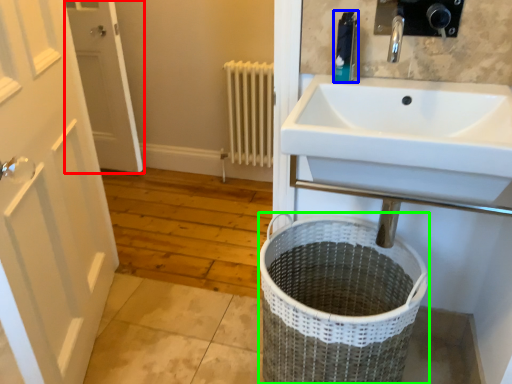
Question: Based on their relative distances, which object is farther from door (highlighted by a red box)? Choose from toiletry (highlighted by a blue box) and laundry basket (highlighted by a green box).

Choices:
 (A) toiletry
 (B) laundry basket

Answer: (A)